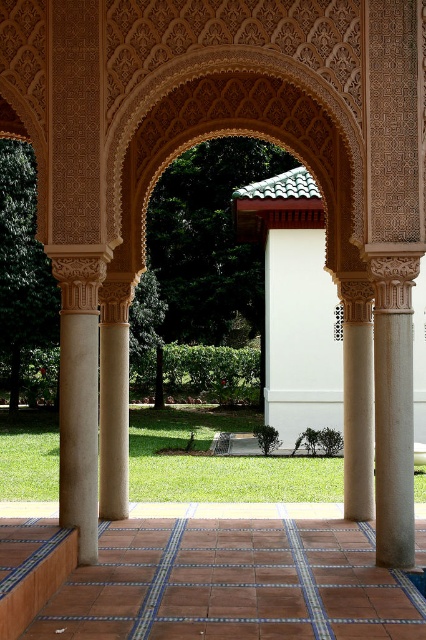
Does point (316, 518) lie behind point (124, 508)?

Yes.

Locate an element on the screen. The height and width of the screenshot is (640, 426). terracotta tile floor at center is located at coordinates (207, 577).

Measure the distance from beige stone column at left to sandy beige column at left.

A distance of 2.10 meters exists between beige stone column at left and sandy beige column at left.

Consider the image. Can you confirm if beige stone column at left is wider than sandy beige column at left?

No.

The width and height of the screenshot is (426, 640). What are the coordinates of `beige stone column at left` in the screenshot? It's located at (78, 428).

From the picture: Does terracotta tile floor at center have a greater height compared to beige stone column at left?

In fact, terracotta tile floor at center may be shorter than beige stone column at left.

Find the location of `terracotta tile floor at center`. terracotta tile floor at center is located at coordinates (207, 577).

Is point (317, 564) farther from camera compared to point (77, 449)?

Yes, point (317, 564) is behind point (77, 449).

Where is `terracotta tile floor at center`? This screenshot has height=640, width=426. terracotta tile floor at center is located at coordinates (207, 577).